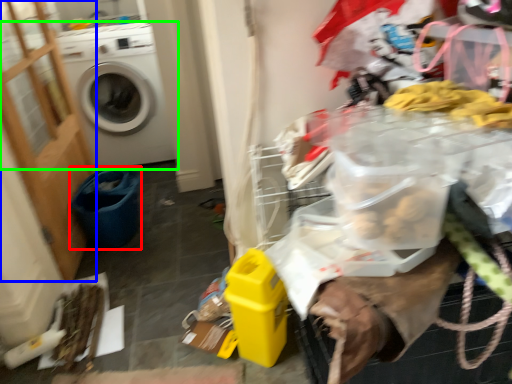
Question: Estimate the real-world distances between objects in this image. Which object is farther from recycling bin (highlighted by a red box), screen door (highlighted by a blue box) or washing machine (highlighted by a green box)?

Choices:
 (A) screen door
 (B) washing machine

Answer: (B)